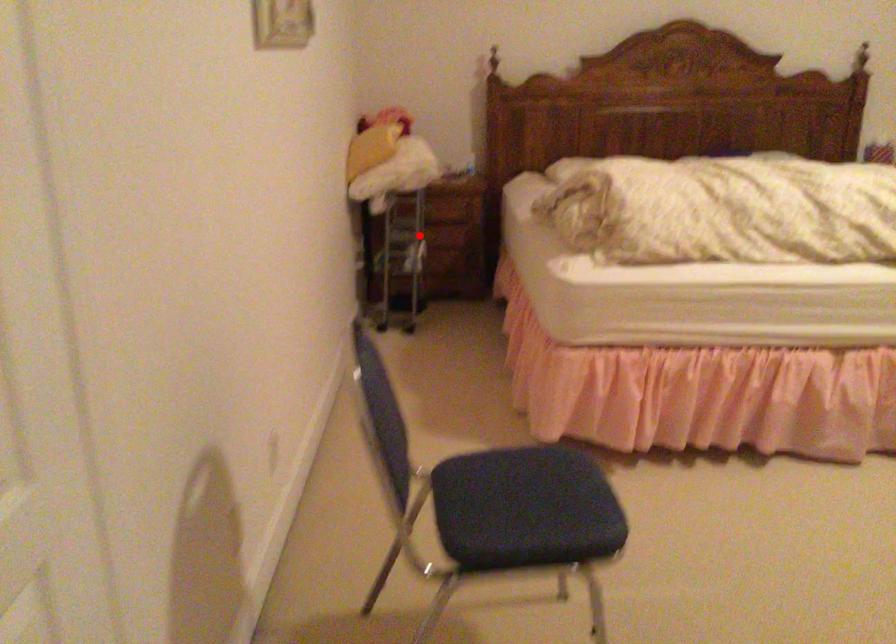
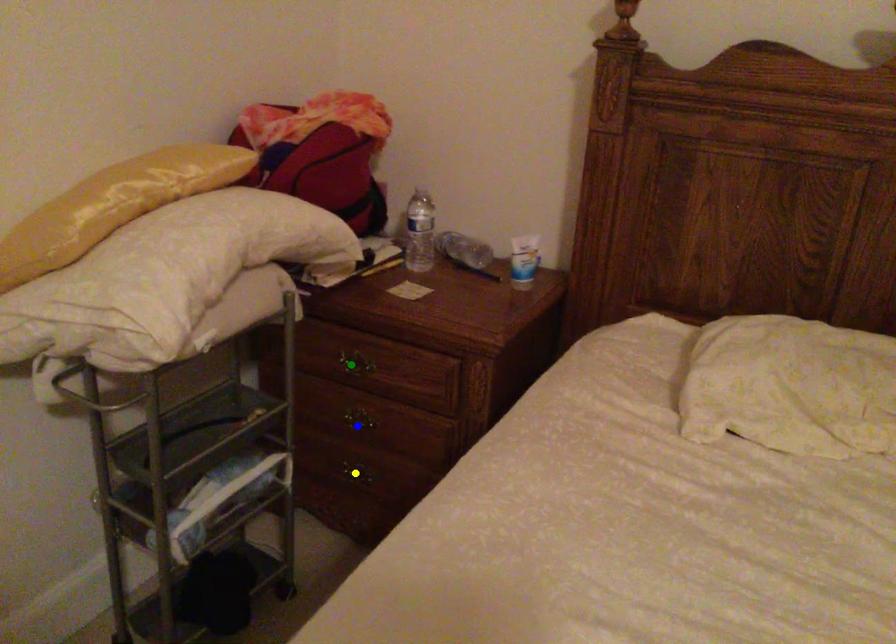
Question: I am providing you with two images of the same scene from different viewpoints. A red point is marked on the first image. You are given multiple points on the second image. Which mark in image 2 goes with the point in image 1?

Choices:
 (A) green point
 (B) yellow point
 (C) blue point

Answer: (C)